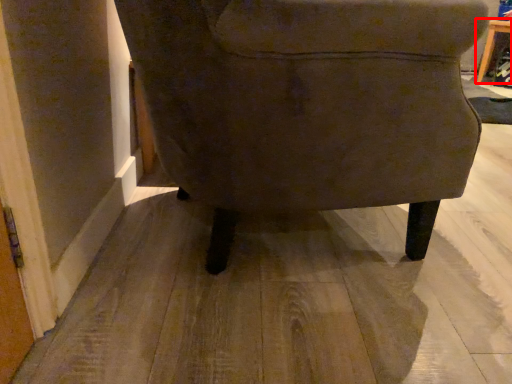
Question: Where is table (annotated by the red box) located in relation to chair in the image?

Choices:
 (A) left
 (B) right

Answer: (B)